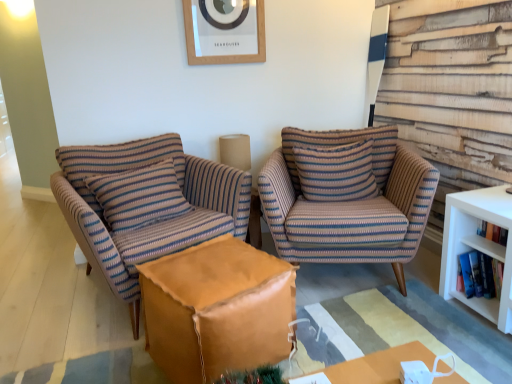
Question: Can you confirm if leather ottoman at center is wider than wooden picture frame at upper center?

Choices:
 (A) yes
 (B) no

Answer: (A)

Question: Is leather ottoman at center behind wooden picture frame at upper center?

Choices:
 (A) yes
 (B) no

Answer: (B)

Question: Is wooden picture frame at upper center located within leather ottoman at center?

Choices:
 (A) no
 (B) yes

Answer: (A)

Question: From the image's perspective, is leather ottoman at center over wooden picture frame at upper center?

Choices:
 (A) yes
 (B) no

Answer: (B)

Question: From the image's perspective, is leather ottoman at center located beneath wooden picture frame at upper center?

Choices:
 (A) yes
 (B) no

Answer: (A)

Question: Is there a large distance between leather ottoman at center and wooden picture frame at upper center?

Choices:
 (A) yes
 (B) no

Answer: (A)

Question: Is white paperbacks at right, the second book when ordered from top to bottom, taller than hardcover book at right, arranged as the 2th book when ordered from the bottom?

Choices:
 (A) no
 (B) yes

Answer: (B)

Question: From the image's perspective, does white paperbacks at right, positioned as the 1th book in bottom-to-top order, appear higher than hardcover book at right, arranged as the first book when viewed from the top?

Choices:
 (A) yes
 (B) no

Answer: (B)

Question: Could you tell me if white paperbacks at right, the second book when ordered from top to bottom, is facing hardcover book at right, arranged as the first book when viewed from the top?

Choices:
 (A) yes
 (B) no

Answer: (B)

Question: Considering the relative sizes of white paperbacks at right, the second book when ordered from top to bottom, and hardcover book at right, arranged as the first book when viewed from the top, in the image provided, is white paperbacks at right, the second book when ordered from top to bottom, thinner than hardcover book at right, arranged as the first book when viewed from the top,?

Choices:
 (A) yes
 (B) no

Answer: (B)

Question: Does white paperbacks at right, the second book when ordered from top to bottom, have a lesser height compared to hardcover book at right, arranged as the first book when viewed from the top?

Choices:
 (A) no
 (B) yes

Answer: (A)

Question: Can you confirm if white paperbacks at right, positioned as the 1th book in bottom-to-top order, is positioned to the right of hardcover book at right, arranged as the 2th book when ordered from the bottom?

Choices:
 (A) no
 (B) yes

Answer: (B)

Question: Is striped fabric armchair at center, which is the second chair in left-to-right order, positioned with its back to striped fabric pillow at center, the 1th pillow from the right?

Choices:
 (A) yes
 (B) no

Answer: (A)